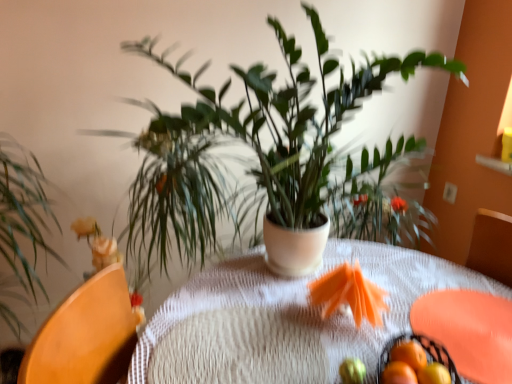
Question: Is orange matte tangerine at lower right, arranged as the third tangerine when viewed from the front, oriented away from smooth yellow fruit at center?

Choices:
 (A) yes
 (B) no

Answer: (B)

Question: Could you tell me if orange matte tangerine at lower right, positioned as the 1th tangerine in back-to-front order, is turned towards smooth yellow fruit at center?

Choices:
 (A) yes
 (B) no

Answer: (B)

Question: Considering the relative sizes of orange matte tangerine at lower right, arranged as the third tangerine when viewed from the front, and smooth yellow fruit at center in the image provided, is orange matte tangerine at lower right, arranged as the third tangerine when viewed from the front, thinner than smooth yellow fruit at center?

Choices:
 (A) no
 (B) yes

Answer: (A)

Question: Is the surface of orange matte tangerine at lower right, arranged as the third tangerine when viewed from the front, in direct contact with smooth yellow fruit at center?

Choices:
 (A) no
 (B) yes

Answer: (A)

Question: From the image's perspective, would you say orange matte tangerine at lower right, arranged as the third tangerine when viewed from the front, is shown under smooth yellow fruit at center?

Choices:
 (A) no
 (B) yes

Answer: (A)

Question: Considering the positions of orange matte tangerine at lower right, positioned as the 1th tangerine in back-to-front order, and smooth yellow fruit at center in the image, is orange matte tangerine at lower right, positioned as the 1th tangerine in back-to-front order, wider or thinner than smooth yellow fruit at center?

Choices:
 (A) thin
 (B) wide

Answer: (B)

Question: Considering the relative positions of orange matte tangerine at lower right, positioned as the 1th tangerine in back-to-front order, and smooth yellow fruit at center in the image provided, is orange matte tangerine at lower right, positioned as the 1th tangerine in back-to-front order, to the left or to the right of smooth yellow fruit at center?

Choices:
 (A) right
 (B) left

Answer: (A)

Question: Considering the positions of orange matte tangerine at lower right, positioned as the 1th tangerine in back-to-front order, and smooth yellow fruit at center in the image, is orange matte tangerine at lower right, positioned as the 1th tangerine in back-to-front order, taller or shorter than smooth yellow fruit at center?

Choices:
 (A) tall
 (B) short

Answer: (A)

Question: Considering their positions, is orange matte tangerine at lower right, positioned as the 1th tangerine in back-to-front order, located in front of or behind smooth yellow fruit at center?

Choices:
 (A) behind
 (B) front

Answer: (A)

Question: Is orange matte tangerine at lower right, arranged as the third tangerine when viewed from the front, situated inside orange matte tangerine at lower right, the 1th tangerine viewed from the front, or outside?

Choices:
 (A) inside
 (B) outside

Answer: (B)

Question: From a real-world perspective, is orange matte tangerine at lower right, arranged as the third tangerine when viewed from the front, positioned above or below orange matte tangerine at lower right, the third tangerine positioned from the back?

Choices:
 (A) below
 (B) above

Answer: (A)

Question: From the image's perspective, is orange matte tangerine at lower right, positioned as the 1th tangerine in back-to-front order, positioned above or below orange matte tangerine at lower right, the 1th tangerine viewed from the front?

Choices:
 (A) below
 (B) above

Answer: (B)

Question: In the image, is orange matte tangerine at lower right, arranged as the third tangerine when viewed from the front, positioned in front of or behind orange matte tangerine at lower right, the 1th tangerine viewed from the front?

Choices:
 (A) behind
 (B) front

Answer: (A)

Question: From the image's perspective, is black wire basket at lower right above or below green leafy plant at left, the 2th houseplant positioned from the right?

Choices:
 (A) above
 (B) below

Answer: (B)

Question: Looking at their shapes, would you say black wire basket at lower right is wider or thinner than green leafy plant at left, the 2th houseplant positioned from the right?

Choices:
 (A) thin
 (B) wide

Answer: (A)